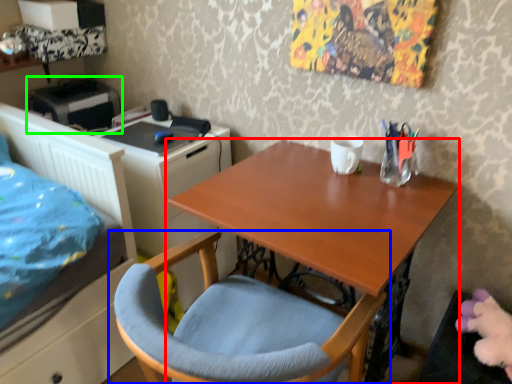
Question: Which is nearer to the desk (highlighted by a red box)? chair (highlighted by a blue box) or printer (highlighted by a green box).

Choices:
 (A) chair
 (B) printer

Answer: (A)